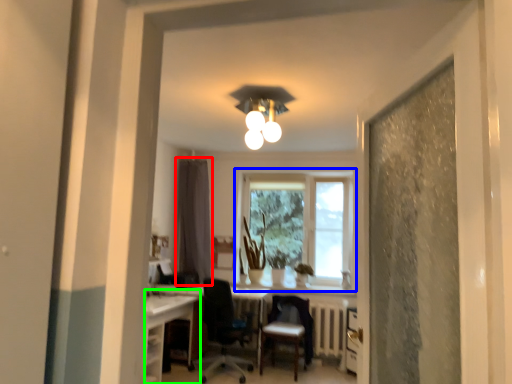
Question: Which is nearer to the curtain (highlighted by a red box)? window (highlighted by a blue box) or computer desk (highlighted by a green box).

Choices:
 (A) window
 (B) computer desk

Answer: (A)